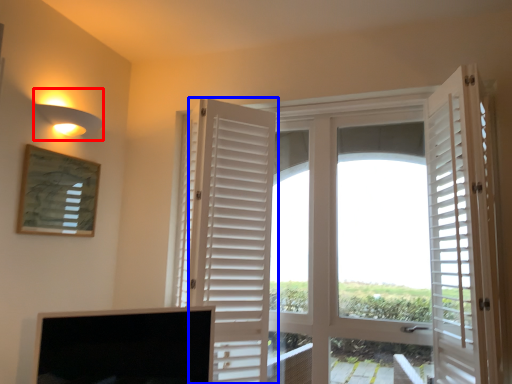
Question: Which point is further to the camera, light fixture (highlighted by a red box) or door (highlighted by a blue box)?

Choices:
 (A) light fixture
 (B) door

Answer: (A)